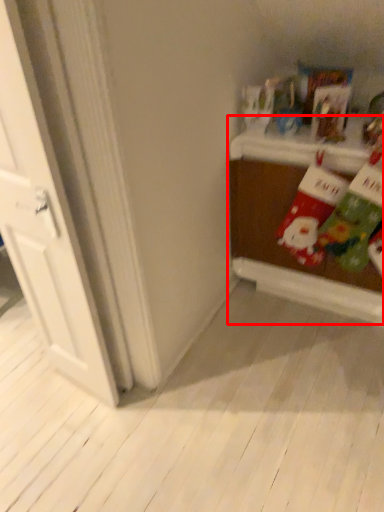
Question: From the image's perspective, what is the correct spatial positioning of table (annotated by the red box) in reference to door?

Choices:
 (A) below
 (B) above

Answer: (B)